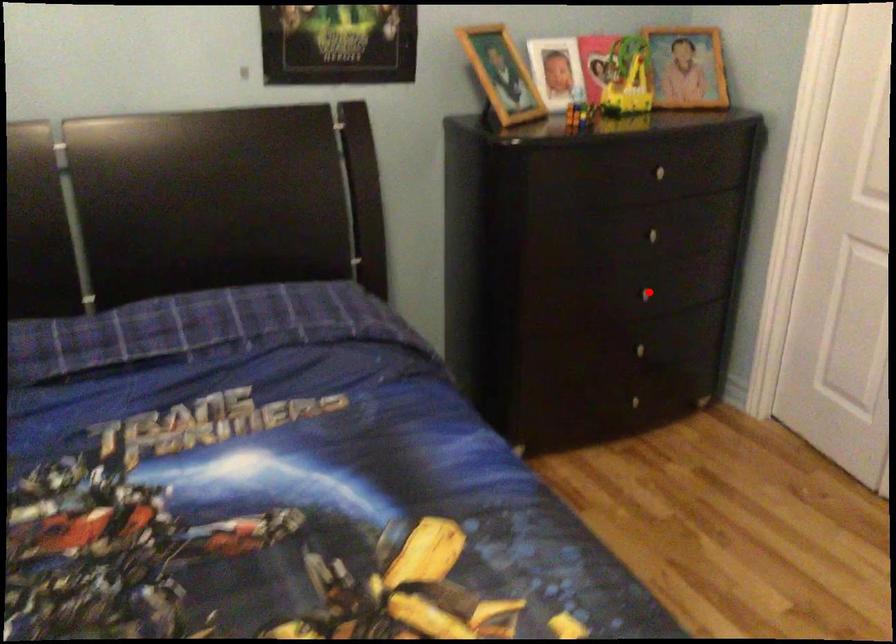
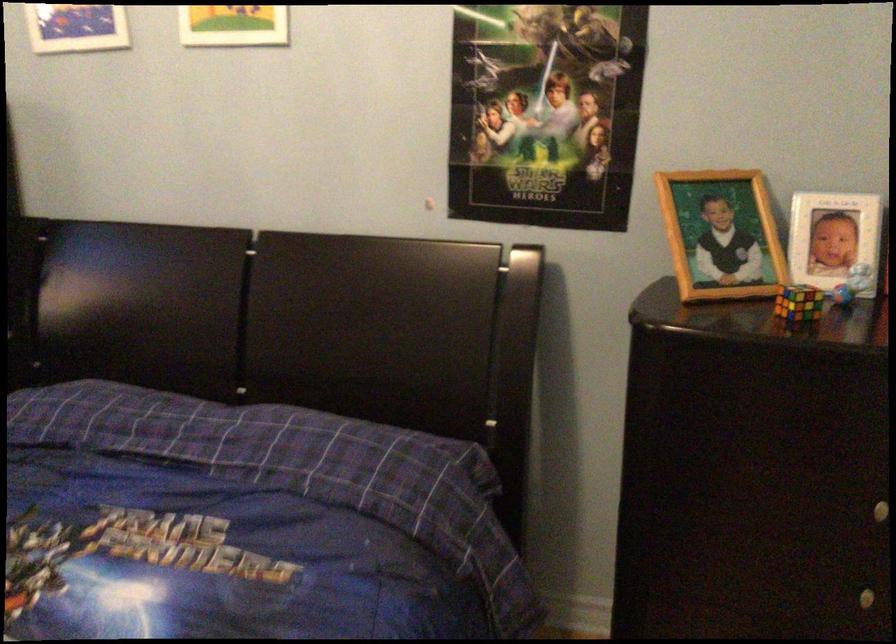
Question: A red point is marked in image1. In image2, is the corresponding 3D point closer to the camera or farther? Reply with the corresponding letter.

Choices:
 (A) The corresponding 3D point is closer.
 (B) The corresponding 3D point is farther.

Answer: (A)